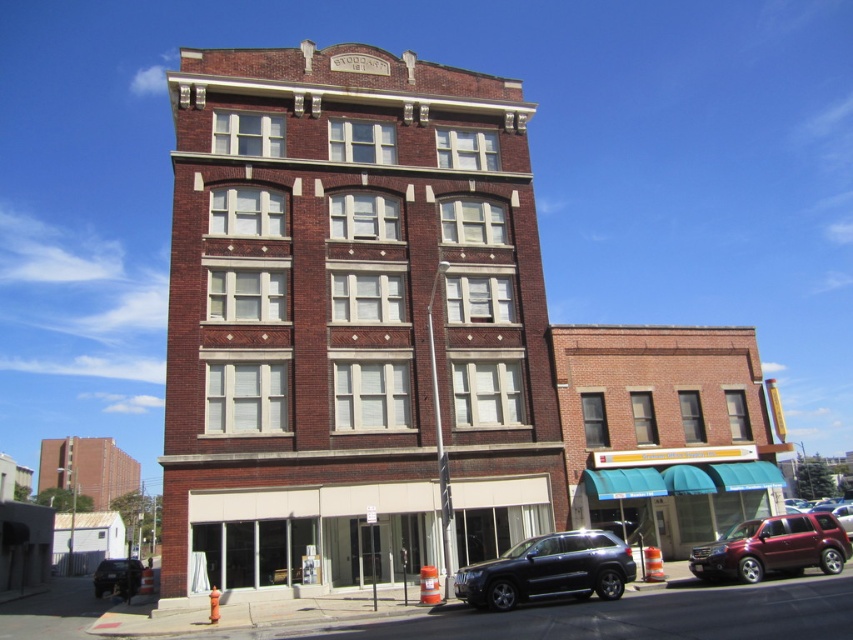
You are standing in front of the multi story brick building and see a point marked at coordinate (773, 547). What object is located at that point?

The point at coordinate (773, 547) corresponds to the satin burgundy suv at lower right.

You are a pedestrian standing in front of the building and want to cross the street. There are two vehicles in front of you, the satin burgundy suv at lower right and the matte black suv at lower left. Which vehicle is closer to the right side of the street?

The satin burgundy suv at lower right is closer to the right side of the street because it is positioned to the right of the matte black suv at lower left.

You are standing in front of the building and want to park your car. You see a black matte suv at lower center and a matte black suv at lower left. Which parking spot is closer to you?

The black matte suv at lower center is closer to the viewer than the matte black suv at lower left, so the parking spot near the black matte suv at lower center is closer.